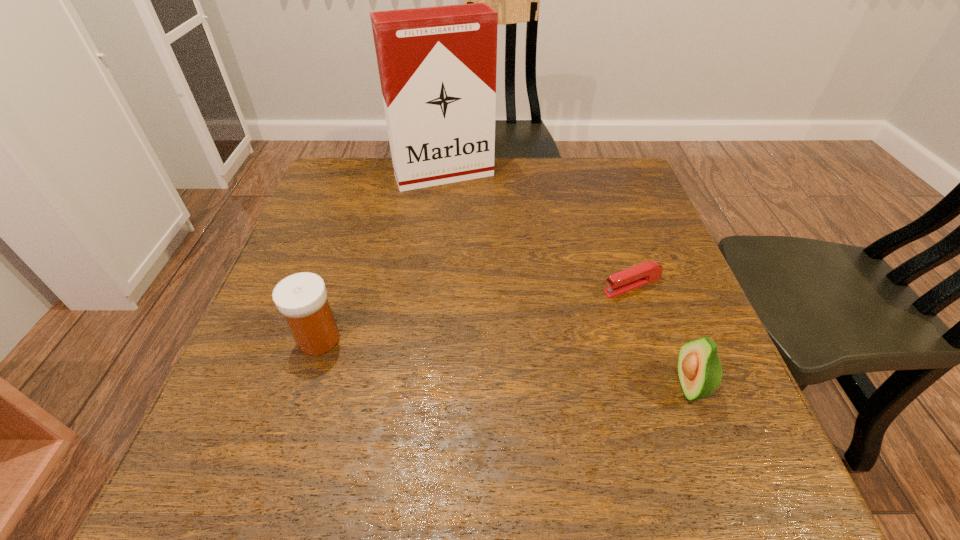
At what (x,y) coordinates should I click in order to perform the action: click on the closest object to the stapler. Please return your answer as a coordinate pair (x, y). Looking at the image, I should click on (699, 368).

Locate an element on the screen. This screenshot has width=960, height=540. free point that satisfies the following two spatial constraints: 1. on the front side of the second object from left to right; 2. on the cut side of the avocado is located at coordinates (421, 386).

Image resolution: width=960 pixels, height=540 pixels. I want to click on vacant region that satisfies the following two spatial constraints: 1. on the front side of the avocado; 2. on the cut side of the leftmost object, so click(x=303, y=386).

Identify the location of vacant region that satisfies the following two spatial constraints: 1. on the front side of the second farthest object; 2. on the cut side of the nearest object. 665,386.

Where is `blank area in the image that satisfies the following two spatial constraints: 1. on the front side of the nearest object; 2. on the cut side of the second nearest object`? blank area in the image that satisfies the following two spatial constraints: 1. on the front side of the nearest object; 2. on the cut side of the second nearest object is located at coordinates click(303, 386).

The height and width of the screenshot is (540, 960). Identify the location of vacant area in the image that satisfies the following two spatial constraints: 1. on the front side of the avocado; 2. on the cut side of the medicine. (303, 386).